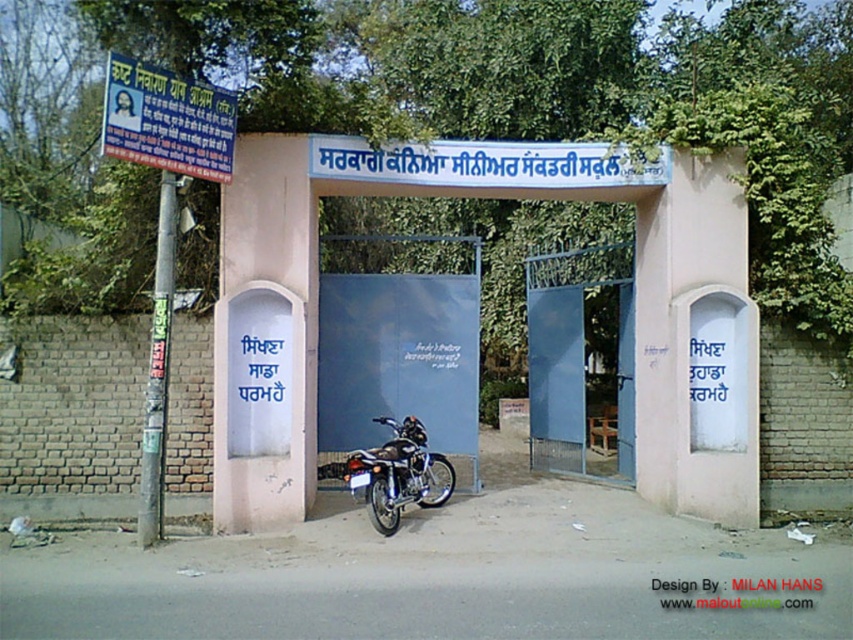
Question: Can you confirm if blue plastic signboard at left is positioned above blue plastic signboard at upper left?

Choices:
 (A) yes
 (B) no

Answer: (B)

Question: Does blue plastic signboard at left appear on the right side of blue plastic signboard at upper left?

Choices:
 (A) no
 (B) yes

Answer: (A)

Question: Which object is farther from the camera taking this photo?

Choices:
 (A) blue plastic signboard at left
 (B) blue plastic signboard at upper left

Answer: (A)

Question: Is blue plastic signboard at left above shiny metallic motorcycle at center?

Choices:
 (A) yes
 (B) no

Answer: (A)

Question: Which of the following is the closest to the observer?

Choices:
 (A) (155, 380)
 (B) (451, 490)

Answer: (A)

Question: Estimate the real-world distances between objects in this image. Which object is farther from the shiny metallic motorcycle at center?

Choices:
 (A) blue plastic signboard at upper left
 (B) blue plastic signboard at left

Answer: (A)